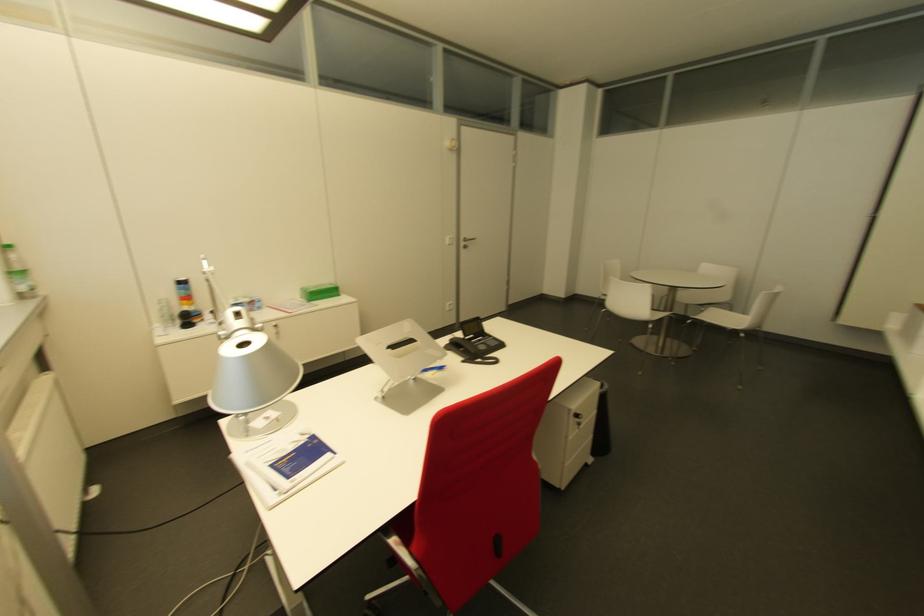
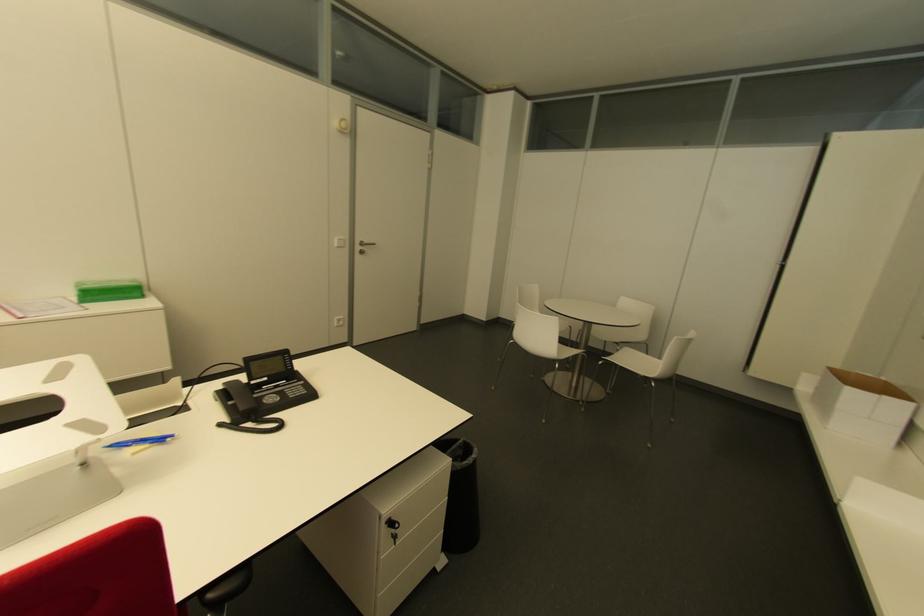
In the second image, find the point that corresponds to (463,246) in the first image.

(360, 253)